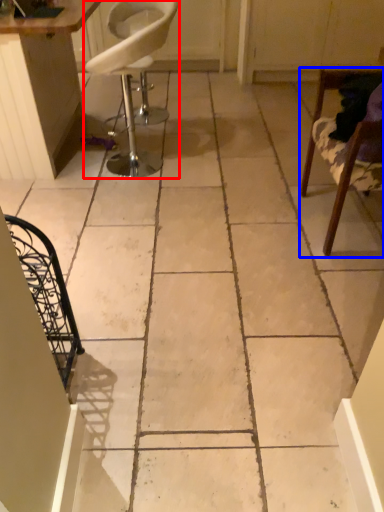
Question: Which of the following is the farthest to the observer, chair (highlighted by a red box) or chair (highlighted by a blue box)?

Choices:
 (A) chair
 (B) chair

Answer: (A)